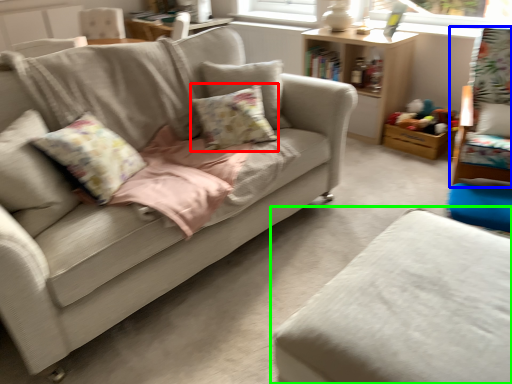
Question: Which object is positioned farthest from pillow (highlighted by a red box)? Select from swivel chair (highlighted by a blue box) and studio couch (highlighted by a green box).

Choices:
 (A) swivel chair
 (B) studio couch

Answer: (A)